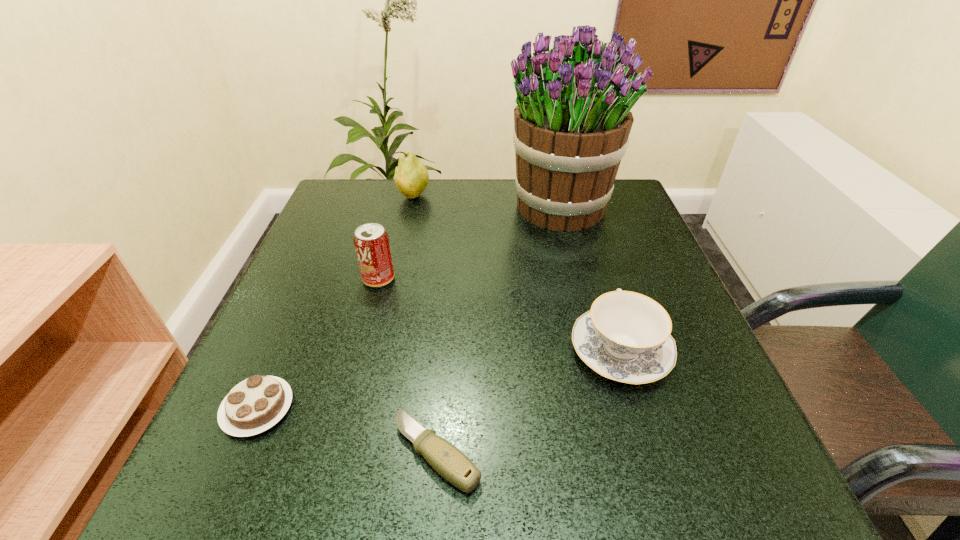
Locate an element on the screen. This screenshot has height=540, width=960. vacant space in between the pocketknife and the bouquet is located at coordinates (499, 330).

You are a GUI agent. You are given a task and a screenshot of the screen. Output one action in this format:
    pyautogui.click(x=<x>, y=<y>)
    Task: Click on the free point between the fourth nearest object and the chinaware
    This screenshot has width=960, height=540.
    Given the screenshot: What is the action you would take?
    pyautogui.click(x=499, y=314)

Where is `free area in between the pear and the pocketknife`? This screenshot has height=540, width=960. free area in between the pear and the pocketknife is located at coordinates tap(425, 324).

Identify the location of free space between the pear and the pocketknife. (425, 324).

Where is `free spot between the chinaware and the soda can`? free spot between the chinaware and the soda can is located at coordinates (499, 314).

Identify the location of vacant point located between the chocolate cake and the third shortest object. Image resolution: width=960 pixels, height=540 pixels. (439, 379).

Image resolution: width=960 pixels, height=540 pixels. In order to click on free area in between the third farthest object and the third object from right to left in this screenshot , I will do `click(408, 366)`.

Locate an element on the screen. This screenshot has width=960, height=540. free space between the leftmost object and the third object from right to left is located at coordinates (348, 430).

Locate an element on the screen. The height and width of the screenshot is (540, 960). object that is the fifth closest to the soda can is located at coordinates (625, 337).

Identify which object is the fifth closest to the chinaware. Please provide its 2D coordinates. Your answer should be formatted as a tuple, i.e. [(x, y)], where the tuple contains the x and y coordinates of a point satisfying the conditions above.

[(411, 178)]